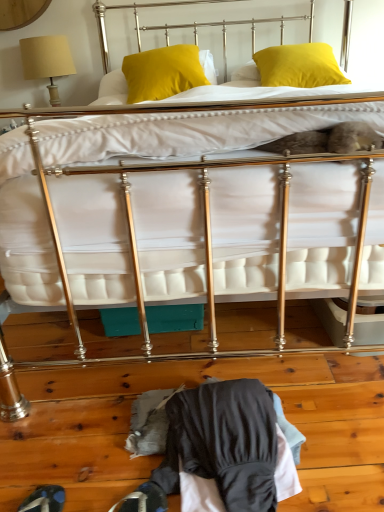
Question: Is yellow velvet pillow at upper center, placed as the 2th pillow when sorted from right to left, smaller than dark blue leather shoe at lower left?

Choices:
 (A) no
 (B) yes

Answer: (A)

Question: From a real-world perspective, is yellow velvet pillow at upper center, placed as the 2th pillow when sorted from right to left, positioned over dark blue leather shoe at lower left based on gravity?

Choices:
 (A) no
 (B) yes

Answer: (B)

Question: Is yellow velvet pillow at upper center, the 1th pillow in the left-to-right sequence, turned away from dark blue leather shoe at lower left?

Choices:
 (A) no
 (B) yes

Answer: (A)

Question: From the image's perspective, does yellow velvet pillow at upper center, the 1th pillow in the left-to-right sequence, appear higher than dark blue leather shoe at lower left?

Choices:
 (A) no
 (B) yes

Answer: (B)

Question: Could you tell me if yellow velvet pillow at upper center, the 1th pillow in the left-to-right sequence, is facing dark blue leather shoe at lower left?

Choices:
 (A) no
 (B) yes

Answer: (A)

Question: Is the depth of yellow velvet pillow at upper center, placed as the 2th pillow when sorted from right to left, greater than that of dark blue leather shoe at lower left?

Choices:
 (A) no
 (B) yes

Answer: (B)

Question: Considering the relative sizes of yellow velvet pillow at upper center, placed as the 2th pillow when sorted from right to left, and yellow matte pillow at upper right, placed as the 1th pillow when sorted from right to left, in the image provided, is yellow velvet pillow at upper center, placed as the 2th pillow when sorted from right to left, taller than yellow matte pillow at upper right, placed as the 1th pillow when sorted from right to left,?

Choices:
 (A) no
 (B) yes

Answer: (B)

Question: Is yellow velvet pillow at upper center, the 1th pillow in the left-to-right sequence, at the right side of yellow matte pillow at upper right, placed as the 1th pillow when sorted from right to left?

Choices:
 (A) yes
 (B) no

Answer: (B)

Question: From the image's perspective, is yellow velvet pillow at upper center, the 1th pillow in the left-to-right sequence, beneath yellow matte pillow at upper right, the second pillow viewed from the left?

Choices:
 (A) no
 (B) yes

Answer: (B)

Question: Is yellow velvet pillow at upper center, the 1th pillow in the left-to-right sequence, at the left side of yellow matte pillow at upper right, placed as the 1th pillow when sorted from right to left?

Choices:
 (A) no
 (B) yes

Answer: (B)

Question: Is yellow velvet pillow at upper center, the 1th pillow in the left-to-right sequence, placed right next to yellow matte pillow at upper right, the second pillow viewed from the left?

Choices:
 (A) yes
 (B) no

Answer: (B)

Question: Can you confirm if yellow velvet pillow at upper center, the 1th pillow in the left-to-right sequence, is wider than yellow matte pillow at upper right, the second pillow viewed from the left?

Choices:
 (A) yes
 (B) no

Answer: (B)

Question: From a real-world perspective, is dark gray fabric at lower center under yellow matte pillow at upper right, placed as the 1th pillow when sorted from right to left?

Choices:
 (A) yes
 (B) no

Answer: (A)